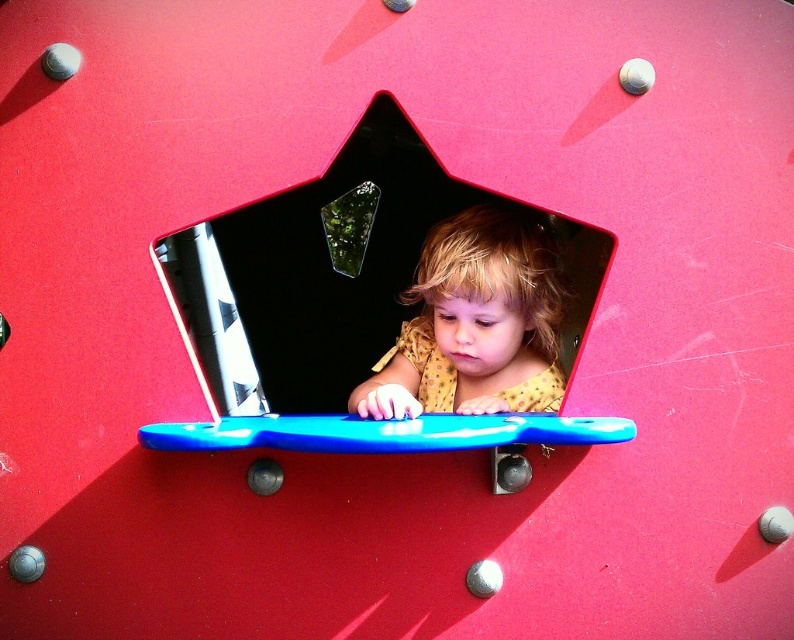
You are a parent standing in front of the red pentagonal structure. You see the polka dot fabric at center. Can you reach it without moving your position?

The polka dot fabric at center is 1.06 meters from viewer, so if the parent can reach that distance, they might be able to touch it. However, this depends on the parent reaching distance.

You are a parent supervising a child at a playground. You see the black glossy star at center and the green translucent plastic at center. Which object is higher up in the structure?

The black glossy star at center is taller than the green translucent plastic at center, so the black glossy star at center is higher up in the structure.

You see a red pentagonal structure with a child interacting with objects inside. There is a polka dot fabric at center and a matte plastic toy at center. From the child perspective, which object is on the right side?

The matte plastic toy at center is on the right side from the child perspective because the polka dot fabric at center is to the left of matte plastic toy at center.